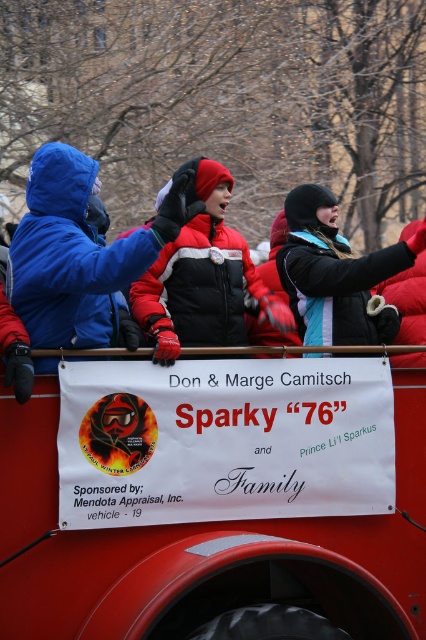
From the picture: Between red and white jacket at center and black fuzzy hat at upper center, which one appears on the right side from the viewer's perspective?

From the viewer's perspective, black fuzzy hat at upper center appears more on the right side.

Consider the image. Can you confirm if red and white jacket at center is smaller than black fuzzy hat at upper center?

Incorrect, red and white jacket at center is not smaller in size than black fuzzy hat at upper center.

Who is more distant from viewer, (x=213, y=337) or (x=316, y=221)?

The point (x=316, y=221) is more distant.

Locate an element on the screen. This screenshot has width=426, height=640. red and white jacket at center is located at coordinates (204, 276).

Which of these two, matte blue jacket at left or red and white jacket at center, stands shorter?

matte blue jacket at left is shorter.

Is point (189, 216) behind point (166, 292)?

No, it is in front of (166, 292).

The image size is (426, 640). I want to click on matte blue jacket at left, so click(78, 252).

How much distance is there between blue fleece jacket at left and red and white jacket at center?

They are 13.07 inches apart.

Is point (187, 204) less distant than point (198, 339)?

Yes, point (187, 204) is closer to viewer.

Is point (89, 237) more distant than point (175, 328)?

That is False.

What are the coordinates of `blue fleece jacket at left` in the screenshot? It's located at (83, 253).